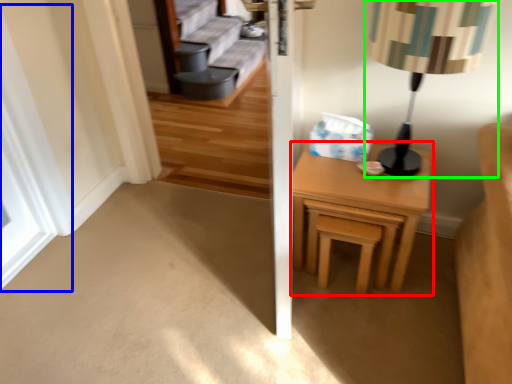
Question: Based on their relative distances, which object is farther from nightstand (highlighted by a red box)? Choose from window (highlighted by a blue box) and table lamp (highlighted by a green box).

Choices:
 (A) window
 (B) table lamp

Answer: (A)